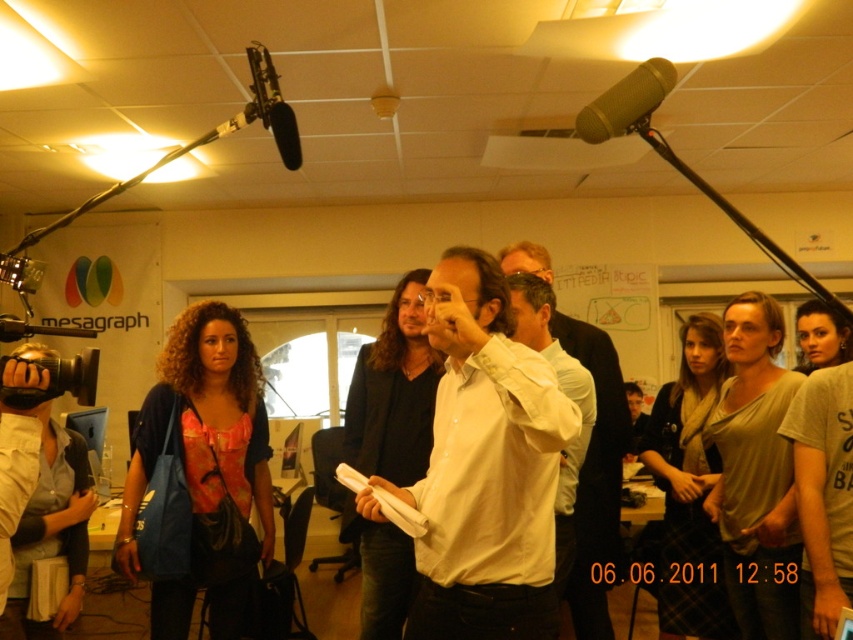
You are a stagehand in the studio and need to adjust the microphone stand that is 1.5 meters tall. The white matte shirt at center is currently 1.45 meters away from you. Can you reach the microphone stand without moving closer?

The white matte shirt at center is 1.45 meters away from the viewer. Since the microphone stand is 1.5 meters tall, you can reach it without moving closer as the stand is slightly taller than the distance.

You are part of the studio crew and need to adjust the microphone stand. Which side of the gold metallic microphone at upper center should you approach from to access the controls on the stand without blocking the person in the white shirt at center?

You should approach from the left side of the gold metallic microphone at upper center since the white shirt at center is positioned to its right, so approaching from the left would avoid blocking them.